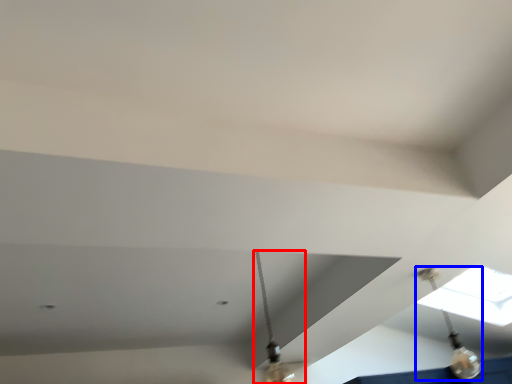
Question: Among these objects, which one is farthest to the camera, lamp (highlighted by a red box) or light fixture (highlighted by a blue box)?

Choices:
 (A) lamp
 (B) light fixture

Answer: (B)